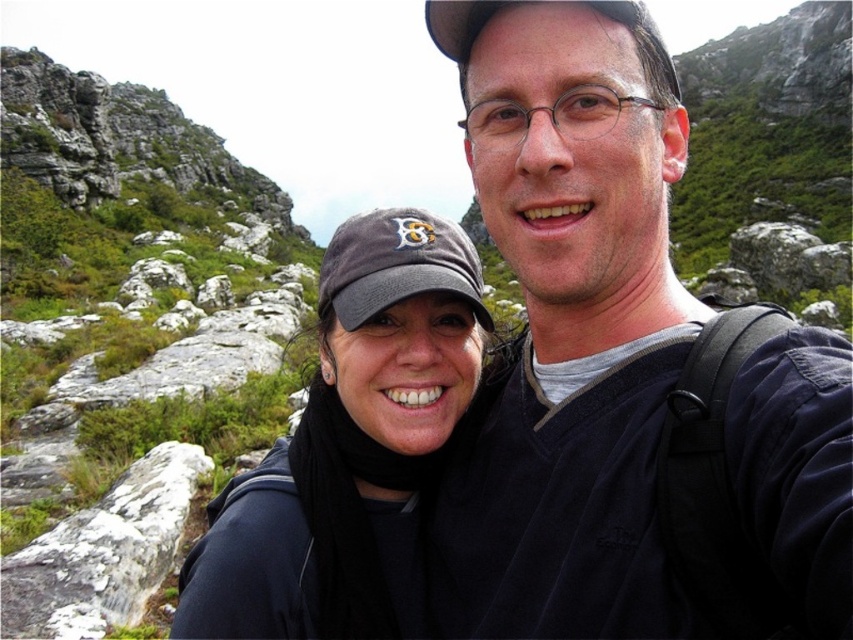
Does white textured rock at lower left appear over dark gray fabric baseball cap at center?

Actually, white textured rock at lower left is below dark gray fabric baseball cap at center.

What are the coordinates of `white textured rock at lower left` in the screenshot? It's located at click(103, 552).

Identify the location of white textured rock at lower left. The height and width of the screenshot is (640, 853). (103, 552).

Which is in front, point (526, 93) or point (151, 534)?

Positioned in front is point (526, 93).

From the picture: Who is positioned more to the left, matte black jacket at center or white textured rock at lower left?

From the viewer's perspective, white textured rock at lower left appears more on the left side.

Does point (755, 444) lie behind point (125, 554)?

No, it is not.

Identify the location of matte black jacket at center. The height and width of the screenshot is (640, 853). (625, 371).

Does matte black jacket at center have a greater width compared to dark gray fabric baseball cap at center?

Indeed, matte black jacket at center has a greater width compared to dark gray fabric baseball cap at center.

Is point (685, 374) farther from camera compared to point (431, 237)?

No, (685, 374) is in front of (431, 237).

You are a GUI agent. You are given a task and a screenshot of the screen. Output one action in this format:
    pyautogui.click(x=<x>, y=<y>)
    Task: Click on the matte black jacket at center
    
    Given the screenshot: What is the action you would take?
    pyautogui.click(x=625, y=371)